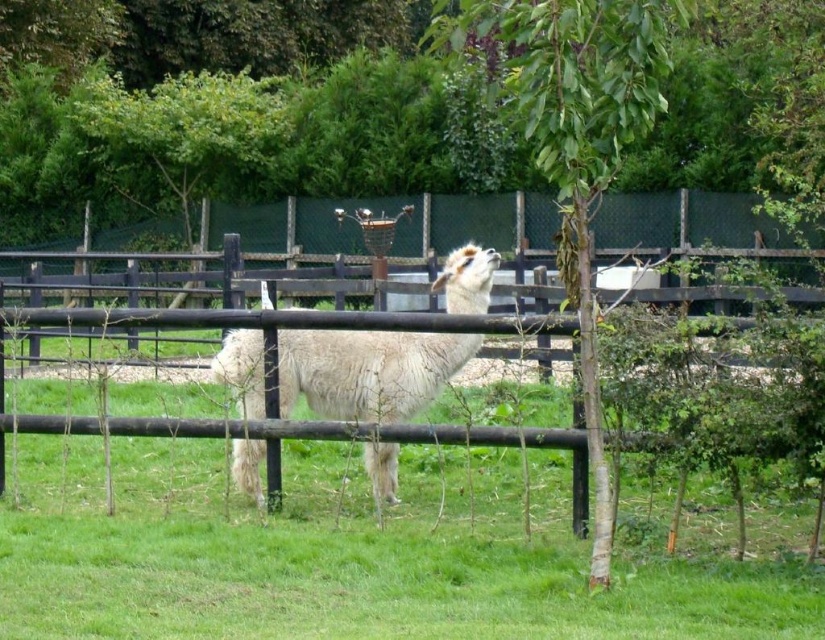
Question: Does green grass at center come in front of white woolly alpaca at center?

Choices:
 (A) no
 (B) yes

Answer: (A)

Question: Which of these objects is positioned farthest from the green leafy tree at center?

Choices:
 (A) white woolly alpaca at center
 (B) black wood fence at center

Answer: (B)

Question: Where is green leafy tree at center located in relation to white woolly alpaca at center in the image?

Choices:
 (A) above
 (B) below

Answer: (A)

Question: Among these objects, which one is farthest from the camera?

Choices:
 (A) green leafy tree at center
 (B) green grass at center

Answer: (B)

Question: Is green leafy tree at center positioned at the back of white woolly alpaca at center?

Choices:
 (A) yes
 (B) no

Answer: (B)

Question: Which of these objects is positioned closest to the black wood fence at center?

Choices:
 (A) green grass at center
 (B) green leafy tree at center

Answer: (B)